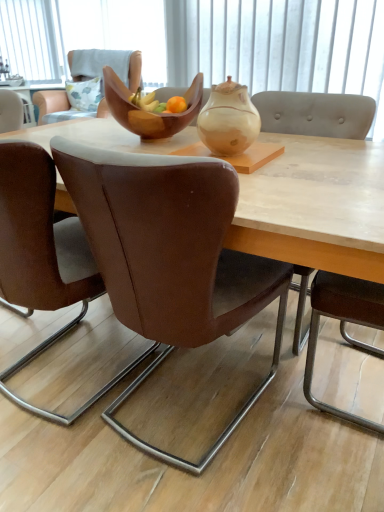
Question: From a real-world perspective, is brown leather chair at center, acting as the 4th chair starting from the back, above or below brown leather chair at center, the 4th chair viewed from the front?

Choices:
 (A) above
 (B) below

Answer: (B)

Question: Relative to brown leather chair at center, which appears as the 1th chair when viewed from the back, is brown leather chair at center, acting as the 4th chair starting from the back, in front or behind?

Choices:
 (A) behind
 (B) front

Answer: (B)

Question: Which is farther from the brown leather chair at center, the 4th chair viewed from the front?

Choices:
 (A) white fabric at upper center
 (B) matte beige teapot at center
 (C) light gray fabric chair at right, the 3th chair when ordered from back to front
 (D) wooden bowl at center
 (E) brown leather chair at center, which is the 2th chair from back to front

Answer: (E)

Question: Estimate the real-world distances between objects in this image. Which object is farther from the fluffy fabric pillow at upper left?

Choices:
 (A) brown leather chair at center, which is the 2th chair from back to front
 (B) light gray fabric chair at right, the 3th chair when ordered from back to front
 (C) matte beige teapot at center
 (D) brown leather chair at center, acting as the 4th chair starting from the back
 (E) white fabric at upper center

Answer: (D)